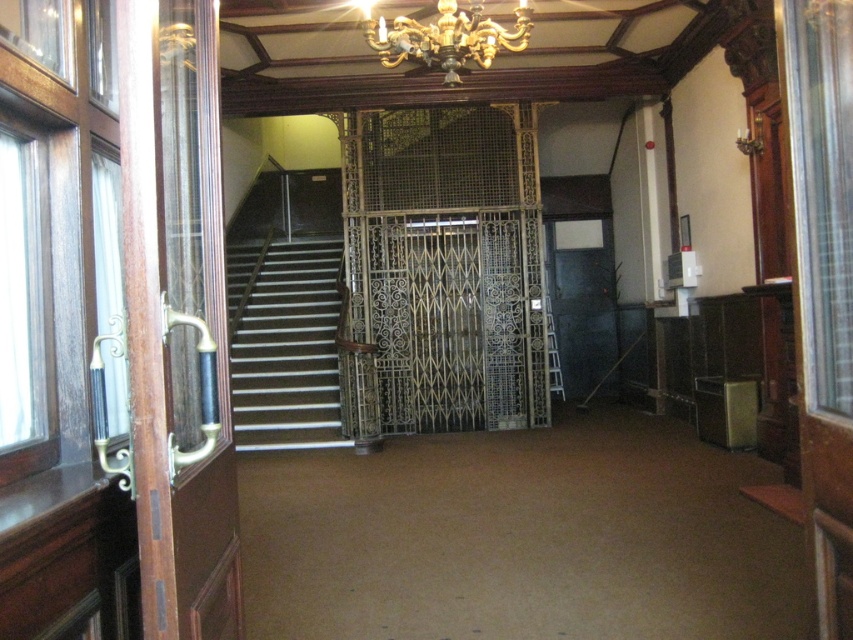
You are a guest in this historic building and want to ascend the stairs. Before moving, you notice both the white glossy stairs at center and the gold metallic chandelier at upper center. Which object is bigger in size?

The white glossy stairs at center is larger in size than the gold metallic chandelier at upper center.

You are standing at the entrance of this historic building and want to take the stairs to the second floor. The gold metallic chandelier at upper center is directly above your head. Where should you look to find the white glossy stairs at center in relation to the chandelier?

The white glossy stairs at center are positioned on the left side of the gold metallic chandelier at upper center, so you should look to the left of the chandelier to find the stairs.

You are a tour guide leading a group through this historic building. You need to decide whether to take the elevator or the stairs to the second floor. Based on the size of the wrought iron elevator at center and the white glossy stairs at center, which one can accommodate a group of 10 people comfortably?

The white glossy stairs at center are larger than the wrought iron elevator at center, so the group of 10 people should take the white glossy stairs at center for more comfortable accommodation.